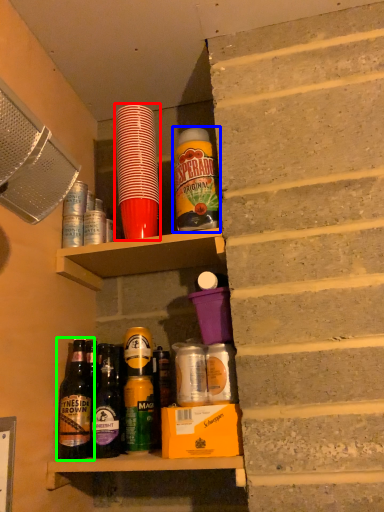
Question: Based on their relative distances, which object is farther from bottle (highlighted by a red box)? Choose from bottle (highlighted by a blue box) and bottle (highlighted by a green box).

Choices:
 (A) bottle
 (B) bottle

Answer: (B)